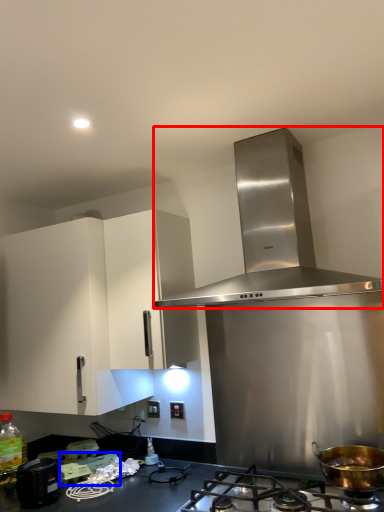
Question: Which point is closer to the camera, home appliance (highlighted by a red box) or appliance (highlighted by a blue box)?

Choices:
 (A) home appliance
 (B) appliance

Answer: (A)